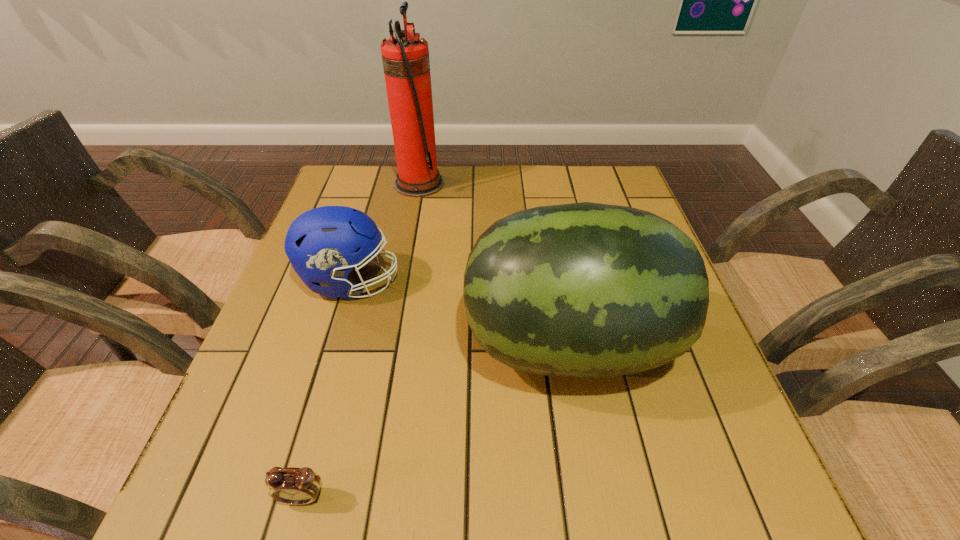
Where is `object that is at the far edge`? object that is at the far edge is located at coordinates (406, 64).

In order to click on object that is at the near edge in this screenshot , I will do `click(296, 486)`.

Locate an element on the screen. football helmet that is at the left edge is located at coordinates (324, 244).

At what (x,y) coordinates should I click in order to perform the action: click on alarm clock that is at the left edge. Please return your answer as a coordinate pair (x, y). This screenshot has height=540, width=960. Looking at the image, I should click on (296, 486).

Locate an element on the screen. object at the right edge is located at coordinates point(585,290).

The image size is (960, 540). In order to click on object that is at the near left corner in this screenshot , I will do `click(296, 486)`.

Locate an element on the screen. This screenshot has height=540, width=960. vacant space at the far edge is located at coordinates (552, 169).

Where is `vacant space at the near edge of the desktop`? Image resolution: width=960 pixels, height=540 pixels. vacant space at the near edge of the desktop is located at coordinates (413, 469).

Where is `vacant space at the far right corner of the desktop`? This screenshot has height=540, width=960. vacant space at the far right corner of the desktop is located at coordinates (609, 202).

Identify the location of vacant space at the near right corner of the desktop. The image size is (960, 540). (668, 497).